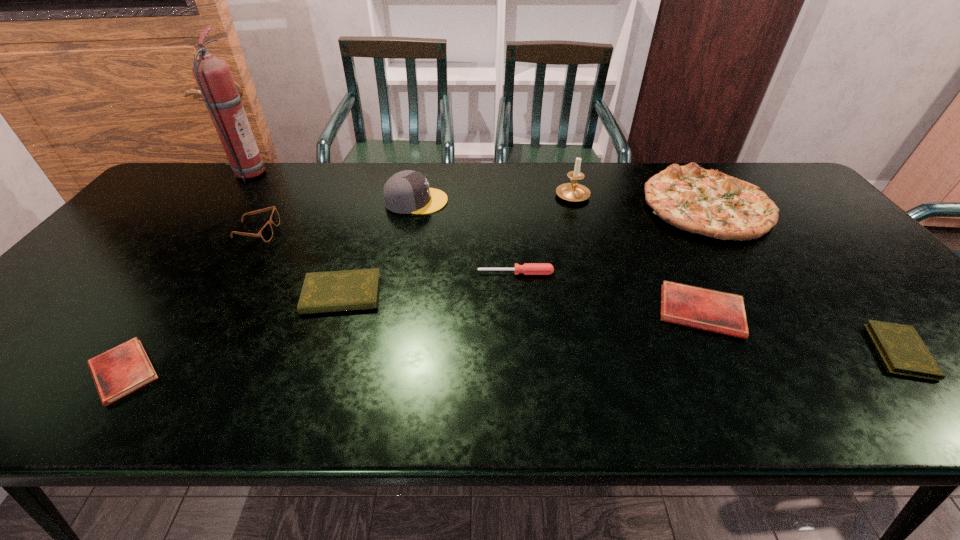
The image size is (960, 540). In order to click on red screwdriver in this screenshot , I will do `click(528, 268)`.

This screenshot has height=540, width=960. In order to click on the tallest diary in this screenshot , I will do [x=331, y=291].

Where is `the bigger green diary`? This screenshot has width=960, height=540. the bigger green diary is located at coordinates (331, 291).

The width and height of the screenshot is (960, 540). In order to click on the bigger red diary in this screenshot , I will do click(720, 312).

At what (x,y) coordinates should I click in order to perform the action: click on the second diary from right to left. Please return your answer as a coordinate pair (x, y). The height and width of the screenshot is (540, 960). Looking at the image, I should click on (720, 312).

In order to click on the nearer green diary in this screenshot , I will do `click(902, 349)`.

The width and height of the screenshot is (960, 540). Find the location of `the right green diary`. the right green diary is located at coordinates (902, 349).

Where is `the left red diary`? Image resolution: width=960 pixels, height=540 pixels. the left red diary is located at coordinates (125, 368).

Where is `the smaller red diary`? The height and width of the screenshot is (540, 960). the smaller red diary is located at coordinates (125, 368).

Find the location of `vacant space located on the side of the fire extinguisher with the label and nozzle`. vacant space located on the side of the fire extinguisher with the label and nozzle is located at coordinates (319, 173).